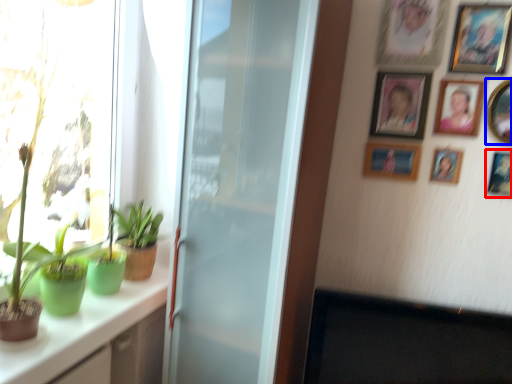
Question: Among these objects, which one is farthest to the camera, picture frame (highlighted by a red box) or picture frame (highlighted by a blue box)?

Choices:
 (A) picture frame
 (B) picture frame

Answer: (A)